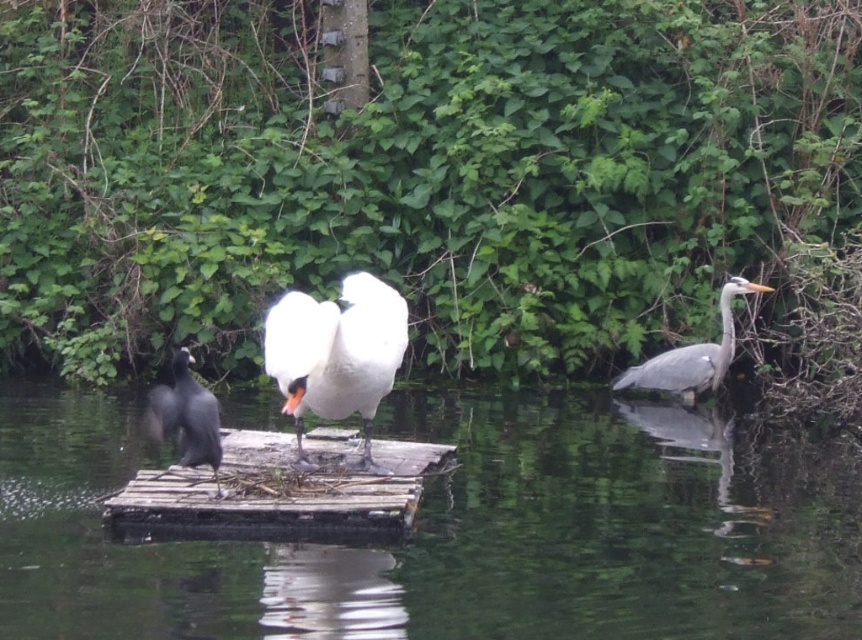
Is point (367, 353) positioned behind point (688, 355)?

No, (367, 353) is closer to viewer.

Can you confirm if white feathered swan at center is smaller than gray matte heron at right?

Indeed, white feathered swan at center has a smaller size compared to gray matte heron at right.

This screenshot has width=862, height=640. What are the coordinates of `white feathered swan at center` in the screenshot? It's located at (336, 353).

Identify the location of white feathered swan at center. This screenshot has height=640, width=862. click(336, 353).

Between gray matte heron at right and black glossy bird at left, which one appears on the left side from the viewer's perspective?

black glossy bird at left is more to the left.

Is gray matte heron at right thinner than black glossy bird at left?

In fact, gray matte heron at right might be wider than black glossy bird at left.

Is point (661, 387) farther from viewer compared to point (150, 420)?

Yes, point (661, 387) is farther from viewer.

In order to click on gray matte heron at right in this screenshot , I will do `click(692, 355)`.

Does clear water at center appear under gray matte heron at right?

Yes.

Is point (79, 627) farther from viewer compared to point (703, 372)?

No, it is not.

You are a GUI agent. You are given a task and a screenshot of the screen. Output one action in this format:
    pyautogui.click(x=<x>, y=<y>)
    Task: Click on the clear water at center
    
    Given the screenshot: What is the action you would take?
    pyautogui.click(x=454, y=531)